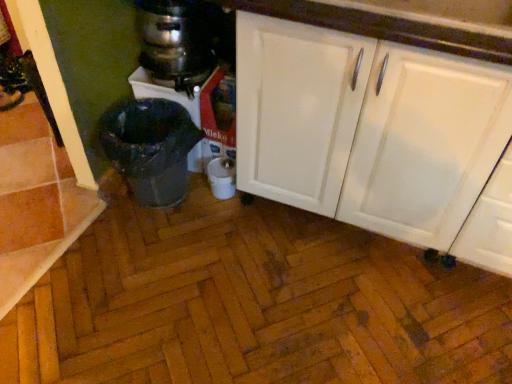
Question: Could you tell me if metallic stainless steel coffee maker at upper left is facing white matte cabinet at center?

Choices:
 (A) no
 (B) yes

Answer: (A)

Question: From the image's perspective, is metallic stainless steel coffee maker at upper left over white matte cabinet at center?

Choices:
 (A) no
 (B) yes

Answer: (B)

Question: Is metallic stainless steel coffee maker at upper left smaller than white matte cabinet at center?

Choices:
 (A) no
 (B) yes

Answer: (B)

Question: Does metallic stainless steel coffee maker at upper left have a greater width compared to white matte cabinet at center?

Choices:
 (A) no
 (B) yes

Answer: (A)

Question: Can white matte cabinet at center be found inside metallic stainless steel coffee maker at upper left?

Choices:
 (A) yes
 (B) no

Answer: (B)

Question: Is point pos(433,41) positioned closer to the camera than point pos(201,56)?

Choices:
 (A) closer
 (B) farther

Answer: (A)

Question: Is white glossy cabinet at upper right situated inside metallic stainless steel coffee maker at upper left or outside?

Choices:
 (A) outside
 (B) inside

Answer: (A)

Question: Considering the positions of white glossy cabinet at upper right and metallic stainless steel coffee maker at upper left in the image, is white glossy cabinet at upper right taller or shorter than metallic stainless steel coffee maker at upper left?

Choices:
 (A) tall
 (B) short

Answer: (A)

Question: In terms of width, does white glossy cabinet at upper right look wider or thinner when compared to metallic stainless steel coffee maker at upper left?

Choices:
 (A) thin
 (B) wide

Answer: (B)

Question: Is metallic silver blender at center inside or outside of white glossy cabinet at upper right?

Choices:
 (A) outside
 (B) inside

Answer: (A)

Question: Is metallic silver blender at center in front of or behind white glossy cabinet at upper right in the image?

Choices:
 (A) front
 (B) behind

Answer: (B)

Question: Looking at the image, does metallic silver blender at center seem bigger or smaller compared to white glossy cabinet at upper right?

Choices:
 (A) small
 (B) big

Answer: (A)

Question: From a real-world perspective, is metallic silver blender at center positioned above or below white glossy cabinet at upper right?

Choices:
 (A) below
 (B) above

Answer: (A)

Question: Looking at the image, does metallic silver blender at center seem bigger or smaller compared to metallic stainless steel coffee maker at upper left?

Choices:
 (A) big
 (B) small

Answer: (A)

Question: Is metallic silver blender at center wider or thinner than metallic stainless steel coffee maker at upper left?

Choices:
 (A) wide
 (B) thin

Answer: (A)